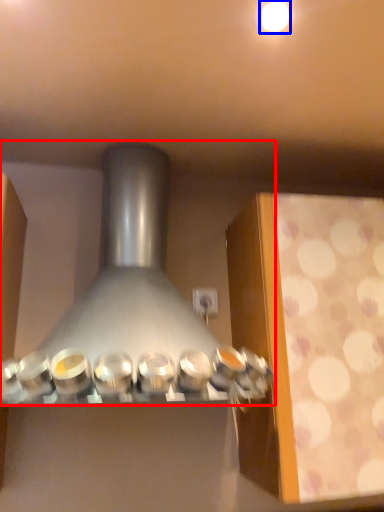
Question: Which point is closer to the camera, kitchen appliance (highlighted by a red box) or lighting (highlighted by a blue box)?

Choices:
 (A) kitchen appliance
 (B) lighting

Answer: (A)